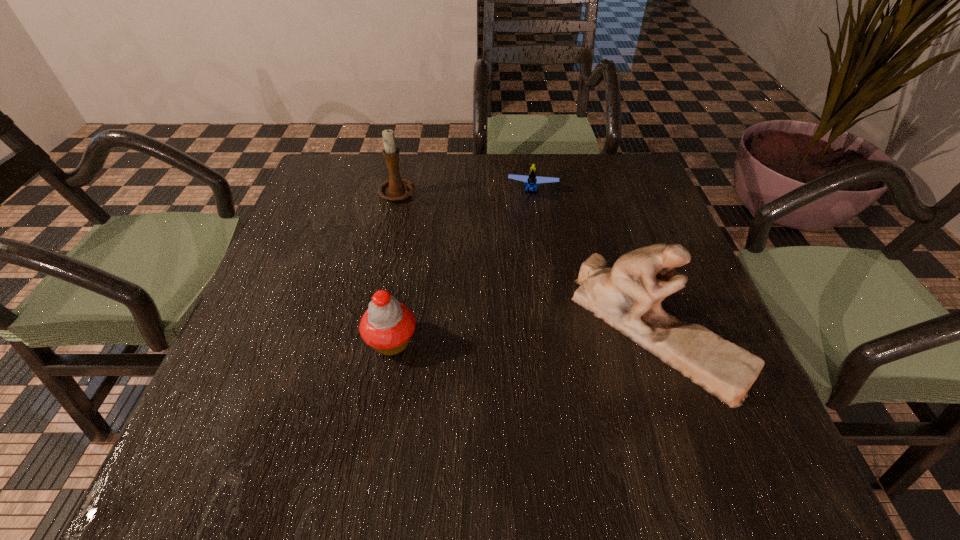
Identify the location of free spot at the far right corner of the desktop. The height and width of the screenshot is (540, 960). (600, 174).

Where is `vacant area between the shortest object and the candle holder`? vacant area between the shortest object and the candle holder is located at coordinates (466, 192).

Where is `free spot between the second shortest object and the candle holder`? free spot between the second shortest object and the candle holder is located at coordinates (395, 268).

This screenshot has width=960, height=540. Identify the location of vacant space in between the candle holder and the cupcake. (395, 268).

This screenshot has height=540, width=960. Identify the location of free spot between the second shortest object and the candle holder. (395, 268).

Locate an element on the screen. Image resolution: width=960 pixels, height=540 pixels. vacant space that is in between the shortest object and the cupcake is located at coordinates (462, 266).

This screenshot has height=540, width=960. In order to click on vacant area that lies between the candle holder and the figurine in this screenshot , I will do `click(527, 261)`.

Find the location of a particular element. The image size is (960, 540). free space between the figurine and the candle holder is located at coordinates (527, 261).

The width and height of the screenshot is (960, 540). In order to click on empty space between the figurine and the candle holder in this screenshot , I will do `click(527, 261)`.

Identify the location of object that is the third closest one to the figurine. (396, 188).